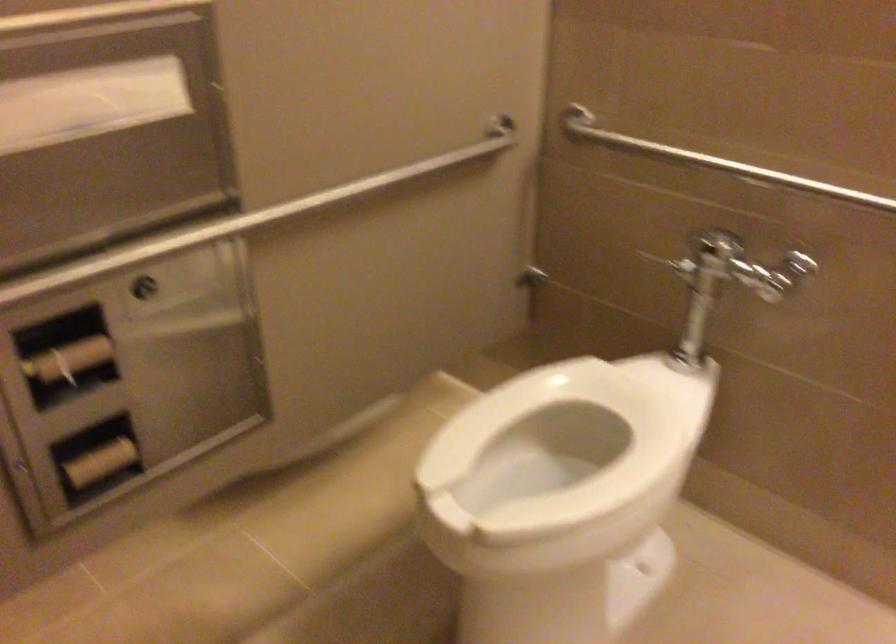
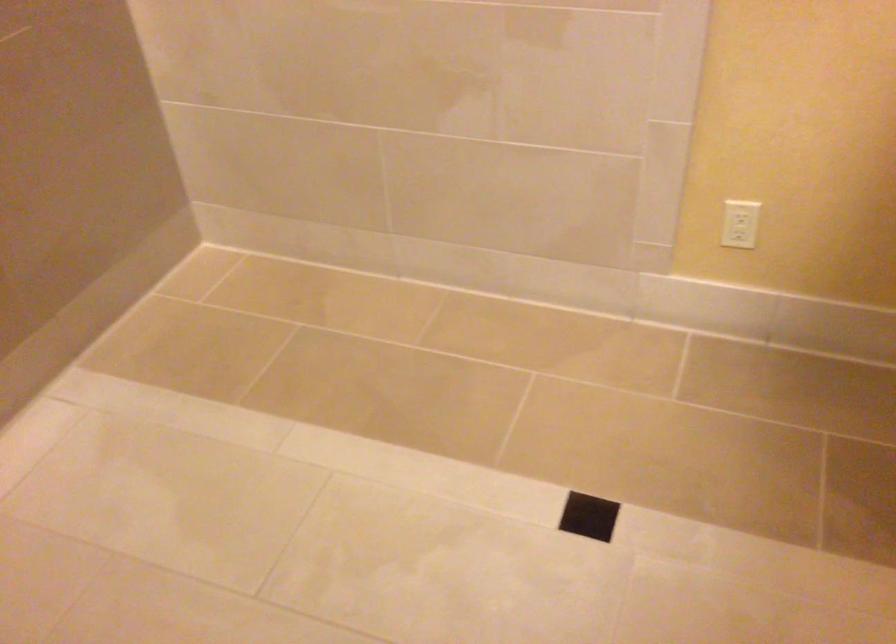
The first image is from the beginning of the video and the second image is from the end. How did the camera likely rotate when shooting the video?

The camera rotated toward right-down.